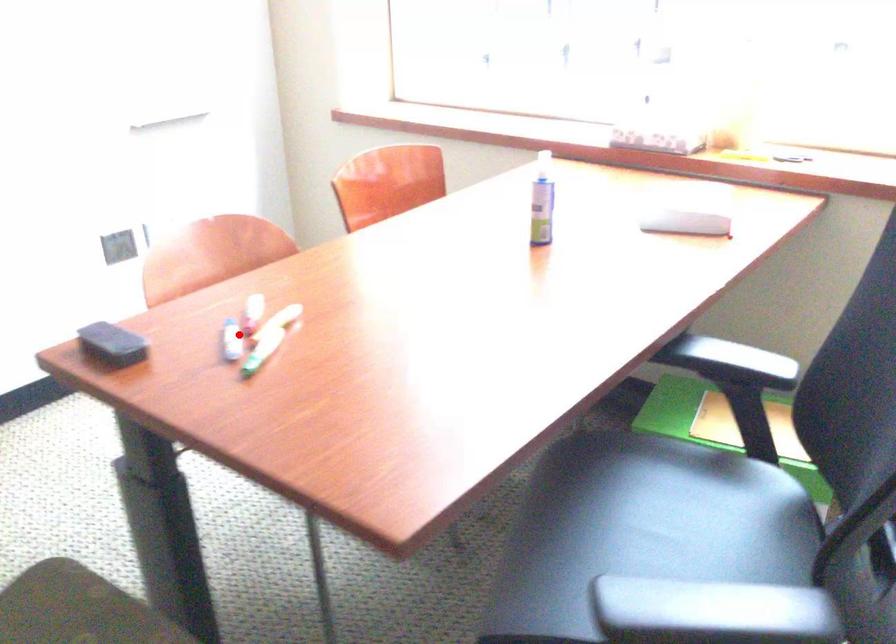
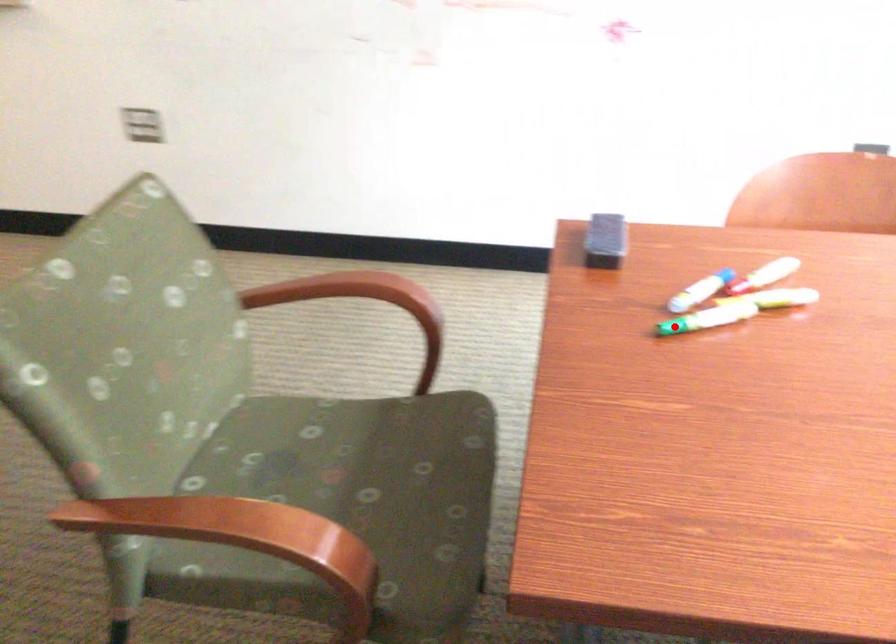
I am providing you with two images of the same scene from different viewpoints. A red point is marked on the first image and another point is marked on the second image. Does the point marked in image1 correspond to the same location as the one in image2?

No